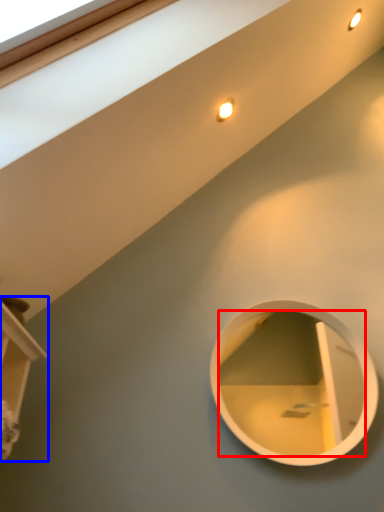
Question: Among these objects, which one is farthest to the camera, mirror (highlighted by a red box) or shelf (highlighted by a blue box)?

Choices:
 (A) mirror
 (B) shelf

Answer: (A)